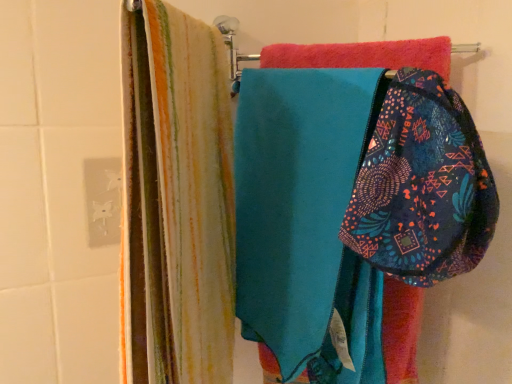
Question: Is patterned fabric pouch at center wider than teal fabric at center?

Choices:
 (A) yes
 (B) no

Answer: (B)

Question: Is patterned fabric pouch at center beside teal fabric at center?

Choices:
 (A) no
 (B) yes

Answer: (A)

Question: Can we say patterned fabric pouch at center lies outside teal fabric at center?

Choices:
 (A) no
 (B) yes

Answer: (A)

Question: From a real-world perspective, is patterned fabric pouch at center on teal fabric at center?

Choices:
 (A) yes
 (B) no

Answer: (A)

Question: Is patterned fabric pouch at center aimed at teal fabric at center?

Choices:
 (A) no
 (B) yes

Answer: (A)

Question: Are patterned fabric pouch at center and teal fabric at center far apart?

Choices:
 (A) no
 (B) yes

Answer: (A)

Question: Considering the relative positions of teal fabric at center and patterned fabric pouch at center in the image provided, is teal fabric at center to the right of patterned fabric pouch at center from the viewer's perspective?

Choices:
 (A) yes
 (B) no

Answer: (B)

Question: Is patterned fabric pouch at center located within teal fabric at center?

Choices:
 (A) yes
 (B) no

Answer: (A)

Question: From a real-world perspective, is teal fabric at center located beneath patterned fabric pouch at center?

Choices:
 (A) no
 (B) yes

Answer: (B)

Question: Is teal fabric at center aimed at patterned fabric pouch at center?

Choices:
 (A) no
 (B) yes

Answer: (B)

Question: Is teal fabric at center smaller than patterned fabric pouch at center?

Choices:
 (A) no
 (B) yes

Answer: (A)

Question: Is teal fabric at center further to camera compared to patterned fabric pouch at center?

Choices:
 (A) yes
 (B) no

Answer: (A)

Question: From a real-world perspective, is patterned fabric pouch at center positioned above or below teal fabric at center?

Choices:
 (A) below
 (B) above

Answer: (B)